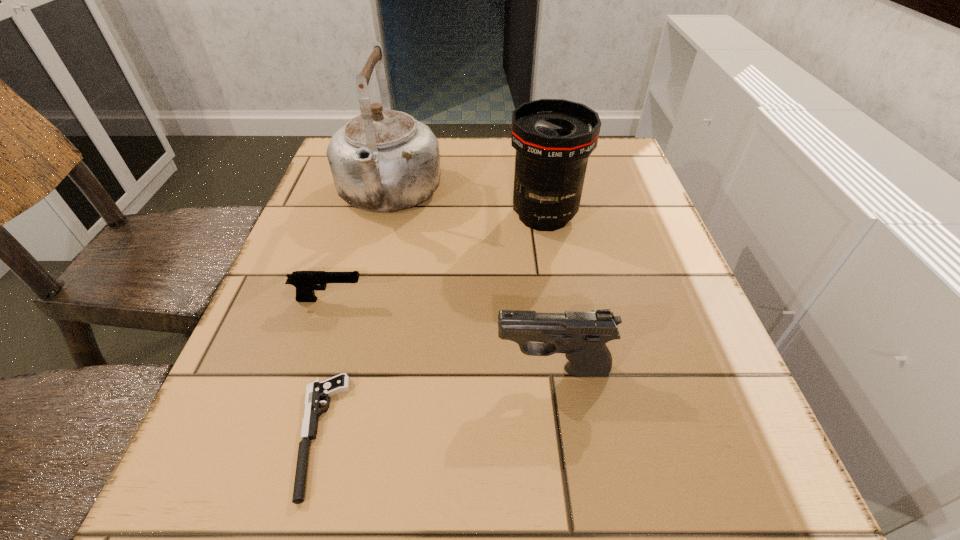
This screenshot has width=960, height=540. In order to click on vacant space that's between the fourth shortest object and the third shortest object in this screenshot , I will do `click(548, 293)`.

The width and height of the screenshot is (960, 540). Find the location of `free space between the shortest pistol and the tallest object`. free space between the shortest pistol and the tallest object is located at coordinates (352, 315).

Find the location of a particular element. The image size is (960, 540). vacant point located between the tallest pistol and the third nearest object is located at coordinates (442, 335).

Identify the location of free space between the third farthest object and the telephoto lens. coord(437,258).

The width and height of the screenshot is (960, 540). What are the coordinates of `empty location between the second tallest object and the shortest pistol` in the screenshot? It's located at (430, 325).

The height and width of the screenshot is (540, 960). I want to click on vacant space that is in between the shortest pistol and the kettle, so click(352, 315).

Find the location of a particular element. This screenshot has height=540, width=960. free space between the fourth shortest object and the farthest pistol is located at coordinates (437, 258).

This screenshot has height=540, width=960. What are the coordinates of `free spot between the rightmost pistol and the kettle` in the screenshot? It's located at (470, 284).

At what (x,y) coordinates should I click in order to perform the action: click on vacant region between the farthest pistol and the third shortest object. Please return your answer as a coordinate pair (x, y). This screenshot has height=540, width=960. Looking at the image, I should click on (442, 335).

Where is `object that is the second closest one to the kettle`? The width and height of the screenshot is (960, 540). object that is the second closest one to the kettle is located at coordinates (305, 282).